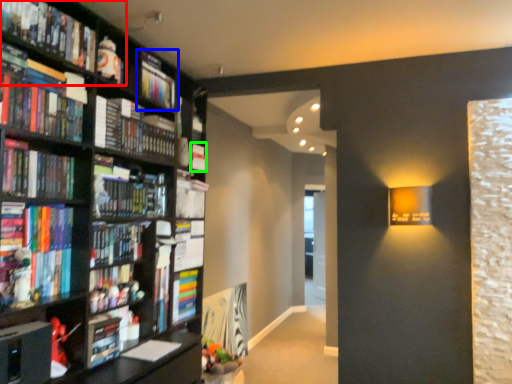
Question: Which object is the closest to the book (highlighted by a red box)? Choose among these: book (highlighted by a blue box) or book (highlighted by a green box).

Choices:
 (A) book
 (B) book

Answer: (A)